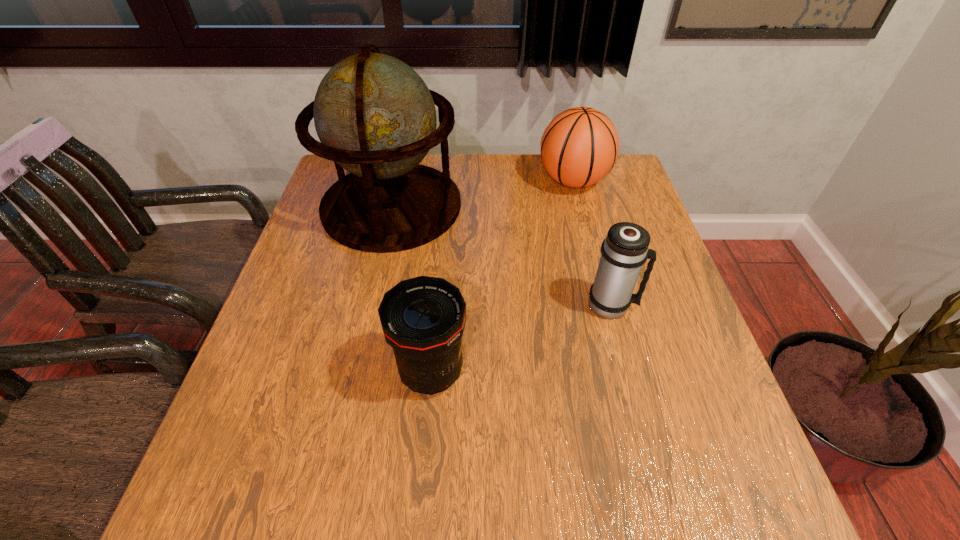
The image size is (960, 540). In order to click on free space in the image that satisfies the following two spatial constraints: 1. on the front-facing side of the tallest object; 2. on the left side of the telephoto lens in this screenshot , I will do `click(354, 372)`.

Where is `free region that satisfies the following two spatial constraints: 1. on the back side of the basketball; 2. on the left side of the nearest object`? The height and width of the screenshot is (540, 960). free region that satisfies the following two spatial constraints: 1. on the back side of the basketball; 2. on the left side of the nearest object is located at coordinates (448, 180).

You are a GUI agent. You are given a task and a screenshot of the screen. Output one action in this format:
    pyautogui.click(x=<x>, y=<y>)
    Task: Click on the free spot that satisfies the following two spatial constraints: 1. on the front-facing side of the telephoto lens; 2. on the right side of the globe
    Image resolution: width=960 pixels, height=540 pixels.
    Given the screenshot: What is the action you would take?
    pyautogui.click(x=354, y=372)

Identify the location of vacant space that satisfies the following two spatial constraints: 1. on the front-facing side of the tallest object; 2. on the right side of the nearest object. (354, 372).